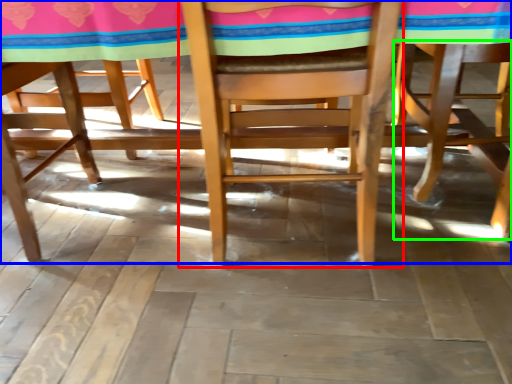
Question: Based on their relative distances, which object is farther from chair (highlighted by a red box)? Choose from table (highlighted by a blue box) and chair (highlighted by a green box).

Choices:
 (A) table
 (B) chair

Answer: (B)